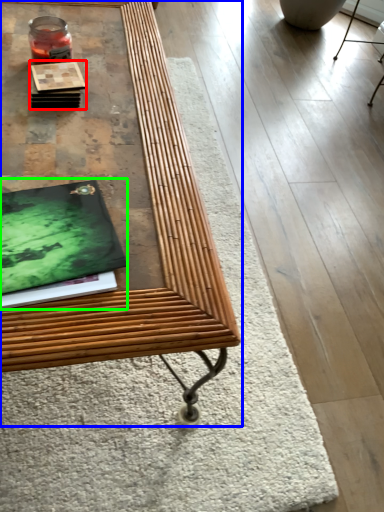
Question: Considering the real-world distances, which object is farthest from book (highlighted by a red box)? table (highlighted by a blue box) or magazine (highlighted by a green box)?

Choices:
 (A) table
 (B) magazine

Answer: (B)